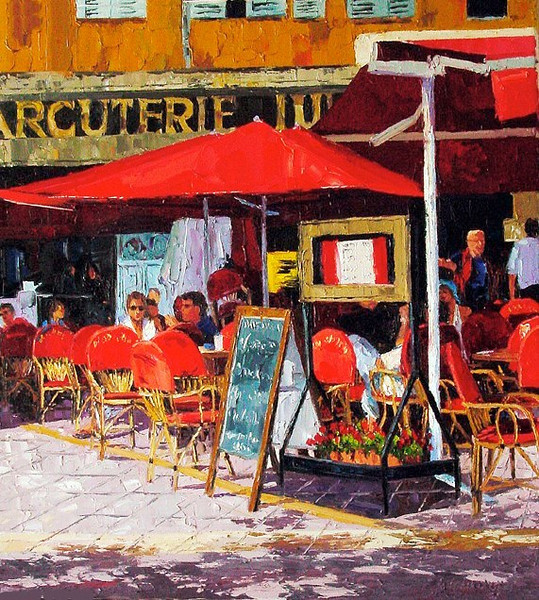
Where is `chair`? chair is located at coordinates (487, 430).